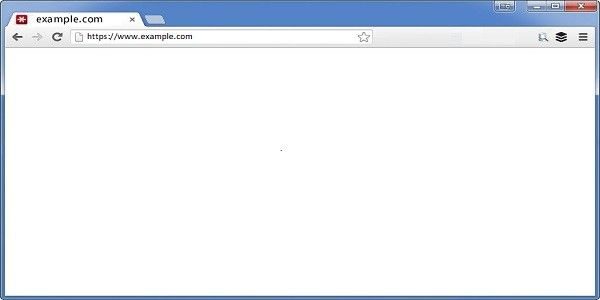
Image resolution: width=600 pixels, height=300 pixels. What are the coordinates of `unused bar space` in the screenshot? It's located at (428, 34).